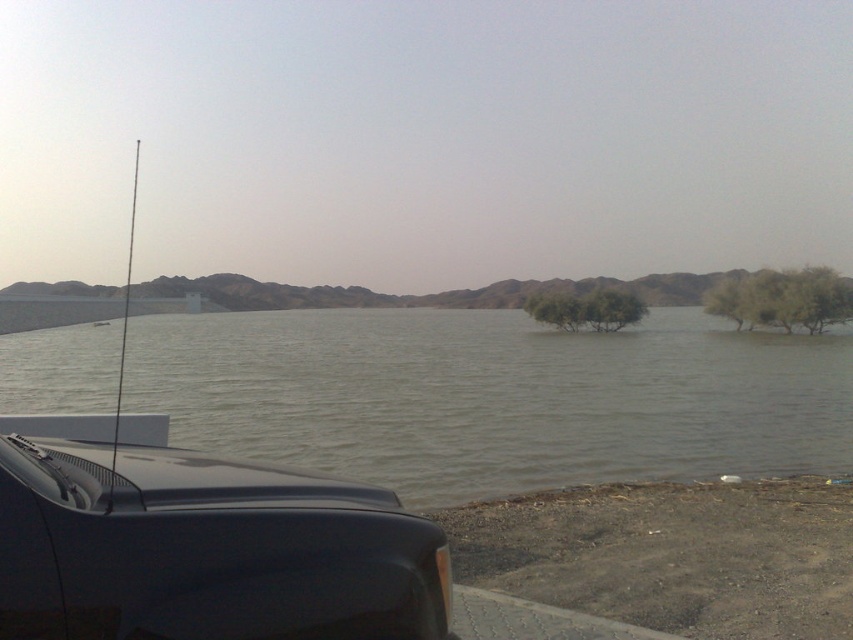
Question: Observing the image, what is the correct spatial positioning of shiny black car at left in reference to glossy black car at lower left?

Choices:
 (A) below
 (B) above

Answer: (A)

Question: Which point is farther from the camera taking this photo?

Choices:
 (A) (596, 308)
 (B) (33, 540)
 (C) (39, 429)

Answer: (A)

Question: Among these objects, which one is nearest to the camera?

Choices:
 (A) glossy black car at lower left
 (B) green leafy tree at right
 (C) green leafy tree at center

Answer: (A)

Question: Is gray matte water at center behind shiny black car at left?

Choices:
 (A) yes
 (B) no

Answer: (A)

Question: Is gray matte water at center further to camera compared to green leafy tree at right?

Choices:
 (A) yes
 (B) no

Answer: (B)

Question: Based on their relative distances, which object is farther from the green leafy tree at center?

Choices:
 (A) glossy black car at lower left
 (B) gray matte water at center
 (C) shiny black car at left
 (D) green leafy tree at right

Answer: (A)